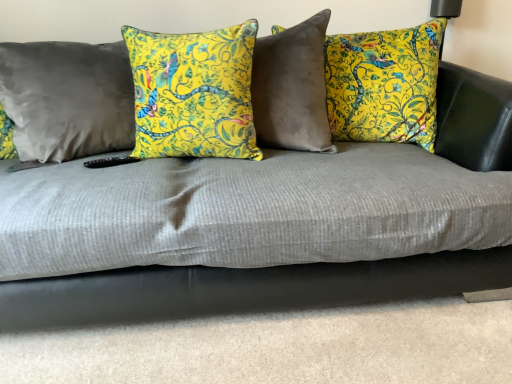
Question: From a real-world perspective, is satin gray pillow at left, placed as the 1th pillow when sorted from left to right, physically below yellow floral pillow at center, the first pillow in the right-to-left sequence?

Choices:
 (A) yes
 (B) no

Answer: (B)

Question: Is satin gray pillow at left, placed as the 1th pillow when sorted from left to right, behind yellow floral pillow at center, the first pillow in the right-to-left sequence?

Choices:
 (A) yes
 (B) no

Answer: (B)

Question: From a real-world perspective, is satin gray pillow at left, the third pillow in the right-to-left sequence, physically above yellow floral pillow at center, which is the third pillow in left-to-right order?

Choices:
 (A) no
 (B) yes

Answer: (B)

Question: Can you confirm if satin gray pillow at left, placed as the 1th pillow when sorted from left to right, is smaller than yellow floral pillow at center, which is the third pillow in left-to-right order?

Choices:
 (A) yes
 (B) no

Answer: (A)

Question: From the image's perspective, is satin gray pillow at left, the third pillow in the right-to-left sequence, located beneath yellow floral pillow at center, which is the third pillow in left-to-right order?

Choices:
 (A) no
 (B) yes

Answer: (B)

Question: Is yellow floral pillow at center, which is the third pillow in left-to-right order, situated inside satin gray pillow at left, placed as the 1th pillow when sorted from left to right, or outside?

Choices:
 (A) outside
 (B) inside

Answer: (A)

Question: From the image's perspective, is yellow floral pillow at center, the first pillow in the right-to-left sequence, located above or below satin gray pillow at left, the third pillow in the right-to-left sequence?

Choices:
 (A) below
 (B) above

Answer: (B)

Question: Is yellow floral pillow at center, which is the third pillow in left-to-right order, taller or shorter than satin gray pillow at left, placed as the 1th pillow when sorted from left to right?

Choices:
 (A) tall
 (B) short

Answer: (A)

Question: In the image, is yellow floral pillow at center, which is the third pillow in left-to-right order, on the left side or the right side of satin gray pillow at left, placed as the 1th pillow when sorted from left to right?

Choices:
 (A) right
 (B) left

Answer: (A)

Question: Looking at the image, does yellow floral pillow at center, the second pillow viewed from the right, seem bigger or smaller compared to satin gray pillow at left, placed as the 1th pillow when sorted from left to right?

Choices:
 (A) small
 (B) big

Answer: (A)

Question: Is yellow floral pillow at center, the second pillow positioned from the left, wider or thinner than satin gray pillow at left, placed as the 1th pillow when sorted from left to right?

Choices:
 (A) wide
 (B) thin

Answer: (B)

Question: From a real-world perspective, is yellow floral pillow at center, the second pillow positioned from the left, above or below satin gray pillow at left, the third pillow in the right-to-left sequence?

Choices:
 (A) above
 (B) below

Answer: (A)

Question: Based on their positions, is yellow floral pillow at center, the second pillow viewed from the right, located to the left or right of satin gray pillow at left, placed as the 1th pillow when sorted from left to right?

Choices:
 (A) left
 (B) right

Answer: (B)

Question: From a real-world perspective, relative to yellow floral pillow at center, the second pillow positioned from the left, is yellow floral pillow at center, the first pillow in the right-to-left sequence, vertically above or below?

Choices:
 (A) below
 (B) above

Answer: (A)

Question: In the image, is yellow floral pillow at center, the first pillow in the right-to-left sequence, positioned in front of or behind yellow floral pillow at center, the second pillow positioned from the left?

Choices:
 (A) front
 (B) behind

Answer: (B)